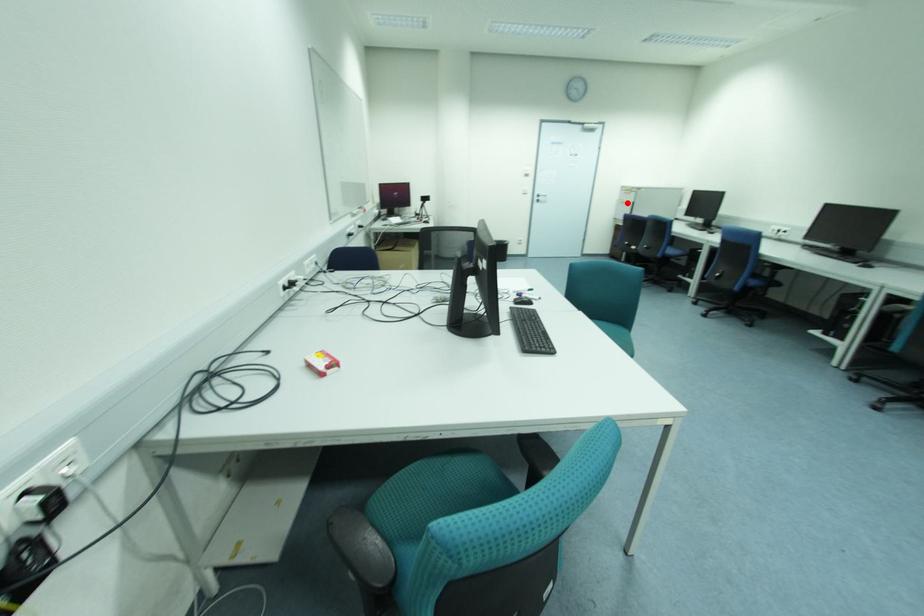
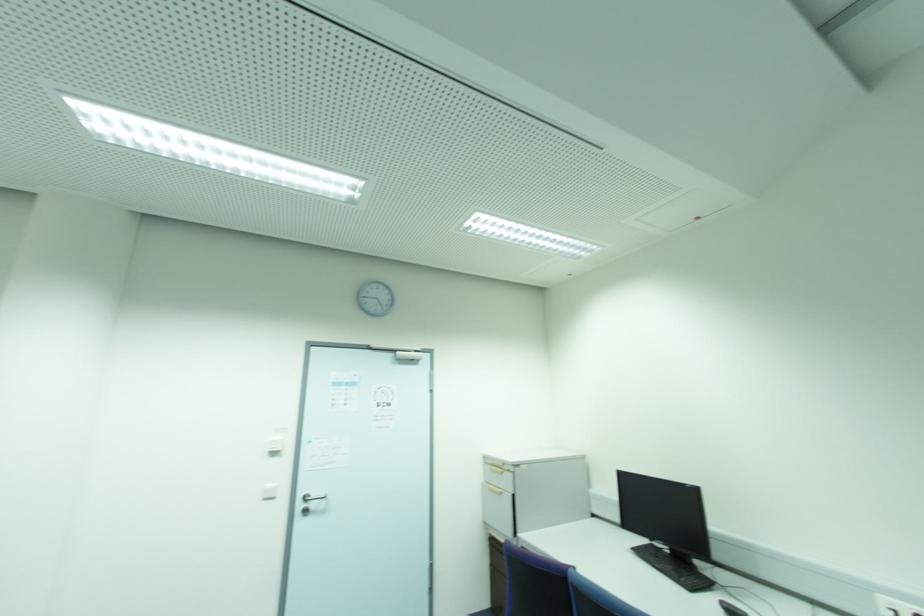
Question: I am providing you with two images of the same scene from different viewpoints. A red point is shown in image1. For the corresponding object point in image2, is it positioned nearer or farther from the camera?

Choices:
 (A) Nearer
 (B) Farther

Answer: (B)